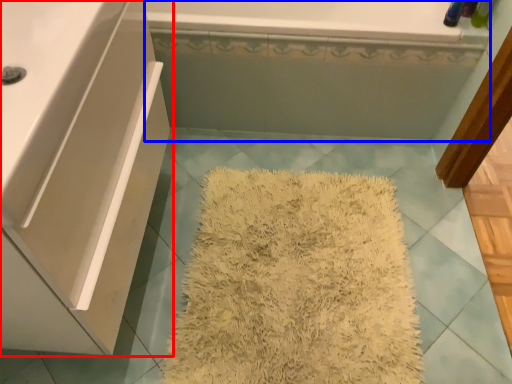
Question: Which point is closer to the camera, bathroom cabinet (highlighted by a red box) or bath (highlighted by a blue box)?

Choices:
 (A) bathroom cabinet
 (B) bath

Answer: (A)